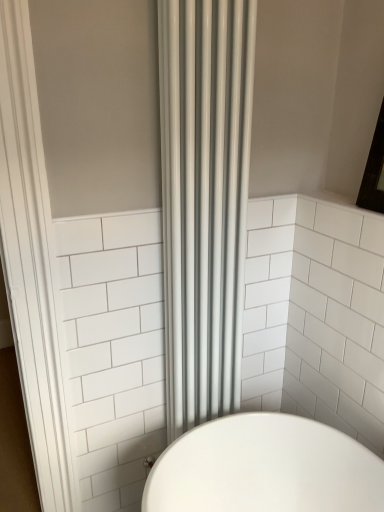
In order to face matte gray radiator at center, should I rotate leftwards or rightwards?

Rotate right and turn 0.595 degrees.

I want to click on matte gray radiator at center, so click(204, 200).

Describe the element at coordinates (204, 200) in the screenshot. I see `matte gray radiator at center` at that location.

Locate an element on the screen. Image resolution: width=384 pixels, height=512 pixels. matte gray radiator at center is located at coordinates (204, 200).